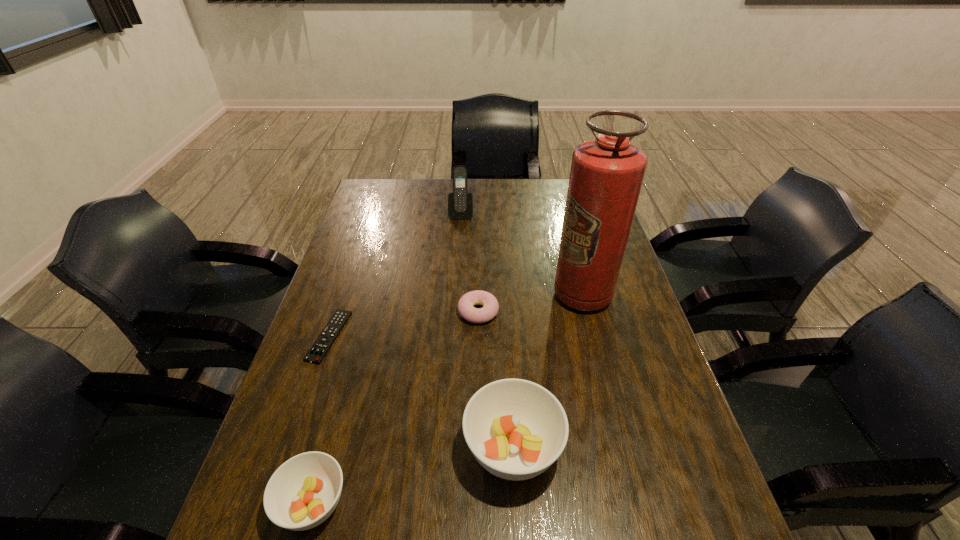
In order to click on free space for a new soup bowl on the right in this screenshot , I will do `click(680, 402)`.